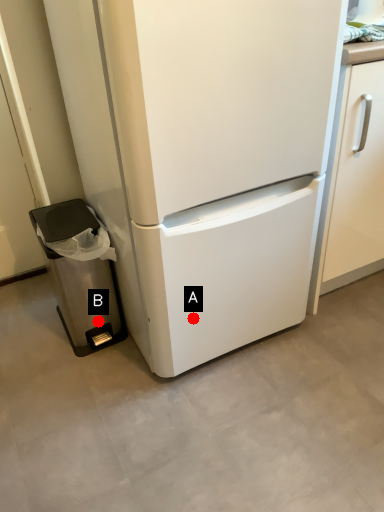
Question: Two points are circled on the image, labeled by A and B beside each circle. Which point is farther to the camera?

Choices:
 (A) A is further
 (B) B is further

Answer: (B)